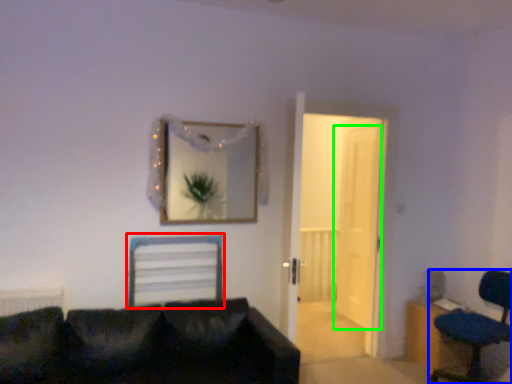
Question: Which object is the farthest from computer chair (highlighted by a red box)? Choose among these: chair (highlighted by a blue box) or door (highlighted by a green box).

Choices:
 (A) chair
 (B) door

Answer: (A)